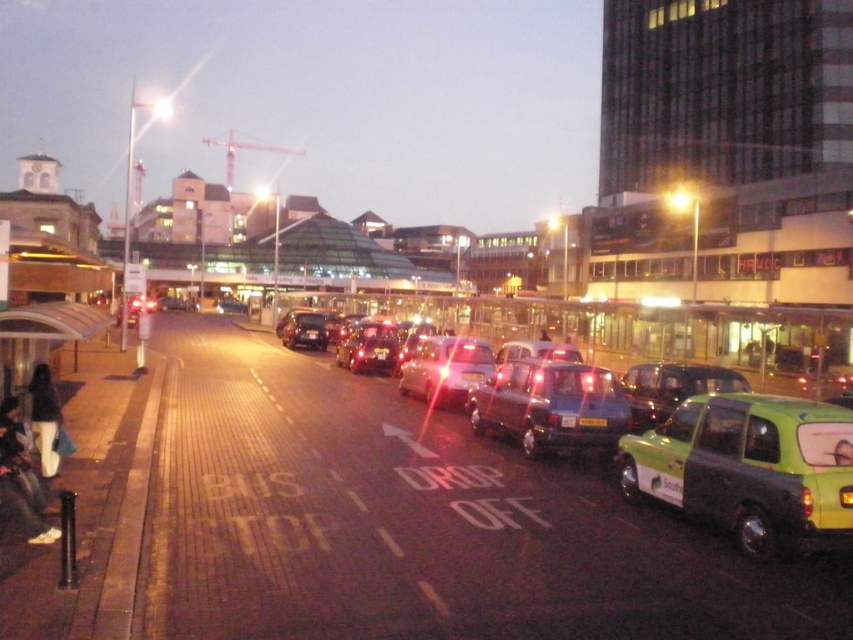
Does green matte taxi at right come in front of metallic green taxi at center?

Yes.

Between green matte taxi at right and metallic green taxi at center, which one has less height?

Standing shorter between the two is metallic green taxi at center.

Is point (676, 435) closer to camera compared to point (462, 360)?

Yes.

I want to click on green matte taxi at right, so click(x=750, y=468).

Does green matte taxi at right have a smaller size compared to green matte taxi at center?

Indeed, green matte taxi at right has a smaller size compared to green matte taxi at center.

You are a GUI agent. You are given a task and a screenshot of the screen. Output one action in this format:
    pyautogui.click(x=<x>, y=<y>)
    Task: Click on the green matte taxi at right
    Image resolution: width=853 pixels, height=640 pixels.
    Given the screenshot: What is the action you would take?
    pyautogui.click(x=750, y=468)

Image resolution: width=853 pixels, height=640 pixels. I want to click on green matte taxi at right, so click(x=750, y=468).

Does metallic gray taxi at center appear over metallic green taxi at center?

Indeed, metallic gray taxi at center is positioned over metallic green taxi at center.

Between point (635, 352) and point (442, 339), which one is positioned in front?

Point (442, 339)

What are the coordinates of `metallic gray taxi at center` in the screenshot? It's located at (737, 413).